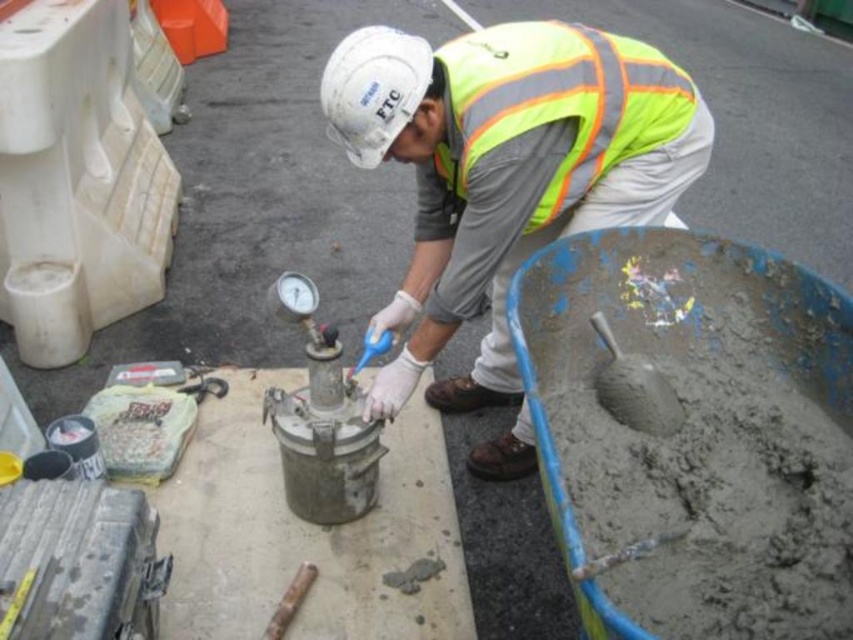
You are a construction supervisor checking the layout of the site. You notice two points marked at coordinates point (531,33) and point (403,124). From the perspective of someone facing the scene, which point is closer to the front?

Point (403,124) is closer to the front because point (531,33) is behind it.

In the scene shown: What object is located at the point coordinates [373,90] in the image?

The point coordinates [373,90] indicate the white hard hat at upper center.

In the scene shown: You are a construction worker standing at the position of point [344,92]. You need to move to point [476,102] to retrieve a tool. Considering the construction site layout described, can you safely walk directly to the target point without obstacles?

Point [476,102] is behind point [344,92], so you cannot safely walk directly to it from your current position as it is located behind you.